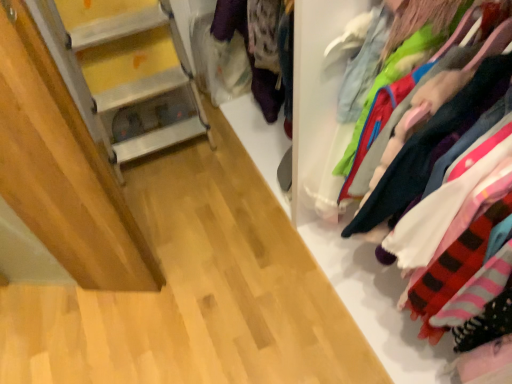
Question: Should I look upward or downward to see multicolored fabric clothes at right?

Choices:
 (A) up
 (B) down

Answer: (A)